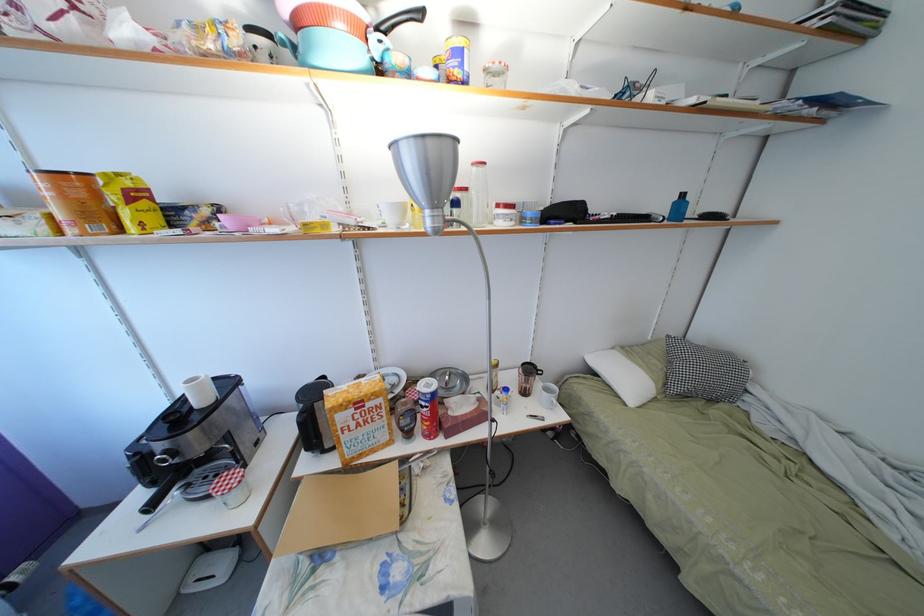
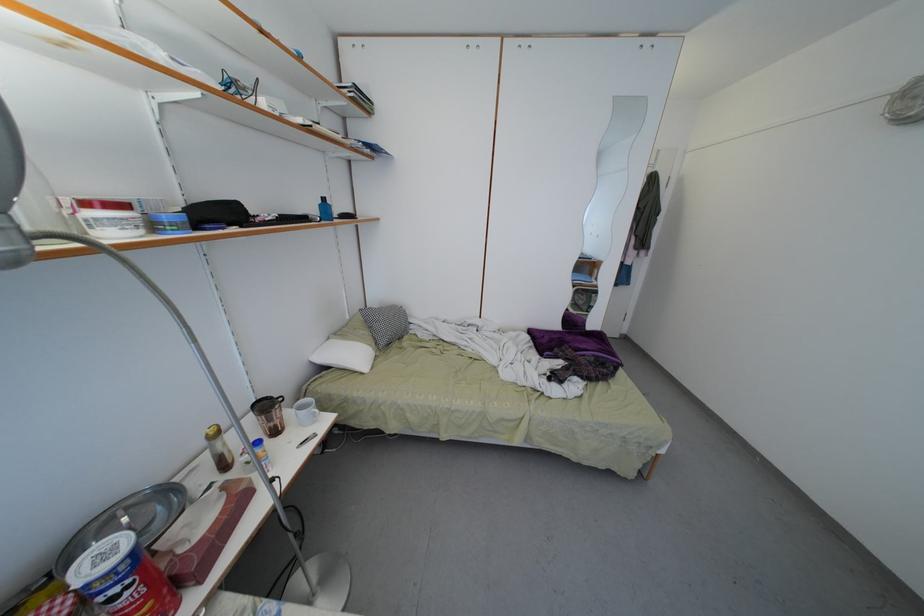
Find the pixel in the second image that matches (x=536, y=375) in the first image.

(271, 411)